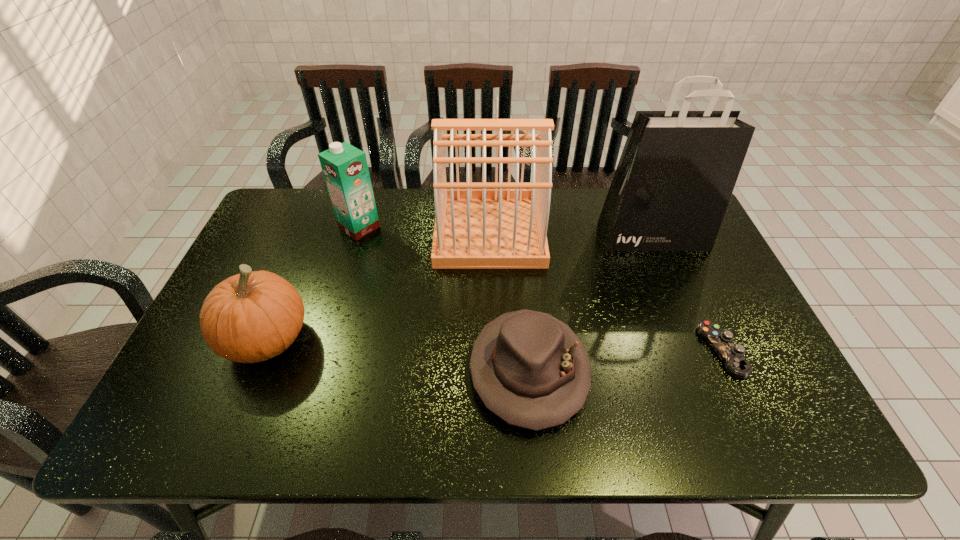
Find the location of a particular element. The width and height of the screenshot is (960, 540). object that is at the far right corner is located at coordinates (677, 171).

This screenshot has width=960, height=540. Find the location of `vacant space at the near edge`. vacant space at the near edge is located at coordinates (482, 438).

I want to click on vacant space at the left edge of the desktop, so click(x=189, y=375).

This screenshot has width=960, height=540. In order to click on vacant space at the right edge of the desktop in this screenshot , I will do `click(712, 309)`.

At what (x,y) coordinates should I click in order to perform the action: click on free space at the far left corner. Please return your answer as a coordinate pair (x, y). The width and height of the screenshot is (960, 540). Looking at the image, I should click on (319, 200).

At what (x,y) coordinates should I click in order to perform the action: click on vacant space at the near left corner of the desktop. Please return your answer as a coordinate pair (x, y). The height and width of the screenshot is (540, 960). Looking at the image, I should click on (223, 441).

Locate an element on the screen. The height and width of the screenshot is (540, 960). free space between the second shortest object and the third shortest object is located at coordinates (398, 355).

Identify the location of vacant area between the shortest object and the fifth tallest object. (625, 360).

You are a GUI agent. You are given a task and a screenshot of the screen. Output one action in this format:
    pyautogui.click(x=<x>, y=<y>)
    Task: Click on the blank region between the fourth tallest object and the second shortest object
    The image size is (960, 540).
    Given the screenshot: What is the action you would take?
    pyautogui.click(x=398, y=355)

The height and width of the screenshot is (540, 960). I want to click on free spot between the second shortest object and the birdcage, so click(509, 301).